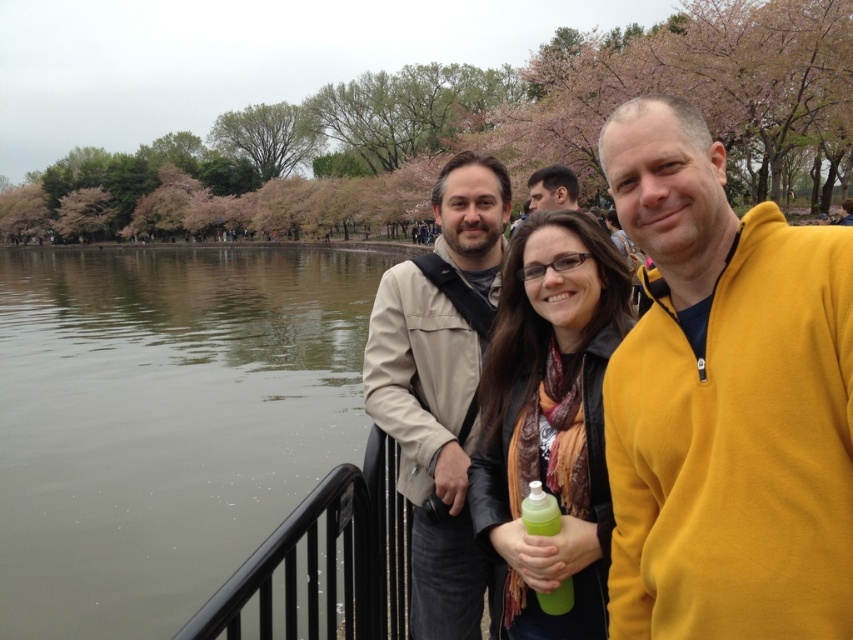
Does yellow fleece jacket at center appear over matte black jacket at upper center?

No, yellow fleece jacket at center is not above matte black jacket at upper center.

Describe the element at coordinates (724, 401) in the screenshot. I see `yellow fleece jacket at center` at that location.

Measure the distance between point [679,257] and camera.

Point [679,257] and camera are 2.61 meters apart from each other.

I want to click on yellow fleece jacket at center, so click(724, 401).

Is black metal railing at lower center taller than green translucent bottle at center?

Indeed, black metal railing at lower center has a greater height compared to green translucent bottle at center.

Locate an element on the screen. black metal railing at lower center is located at coordinates (329, 560).

Identify the location of black metal railing at lower center. The image size is (853, 640). (329, 560).

Which of these two, black metal railing at lower center or matte black jacket at upper center, stands taller?

matte black jacket at upper center

Can you confirm if black metal railing at lower center is positioned to the left of matte black jacket at upper center?

Indeed, black metal railing at lower center is positioned on the left side of matte black jacket at upper center.

Who is more distant from viewer, (x=395, y=513) or (x=540, y=188)?

Point (x=540, y=188)

This screenshot has height=640, width=853. I want to click on black metal railing at lower center, so click(x=329, y=560).